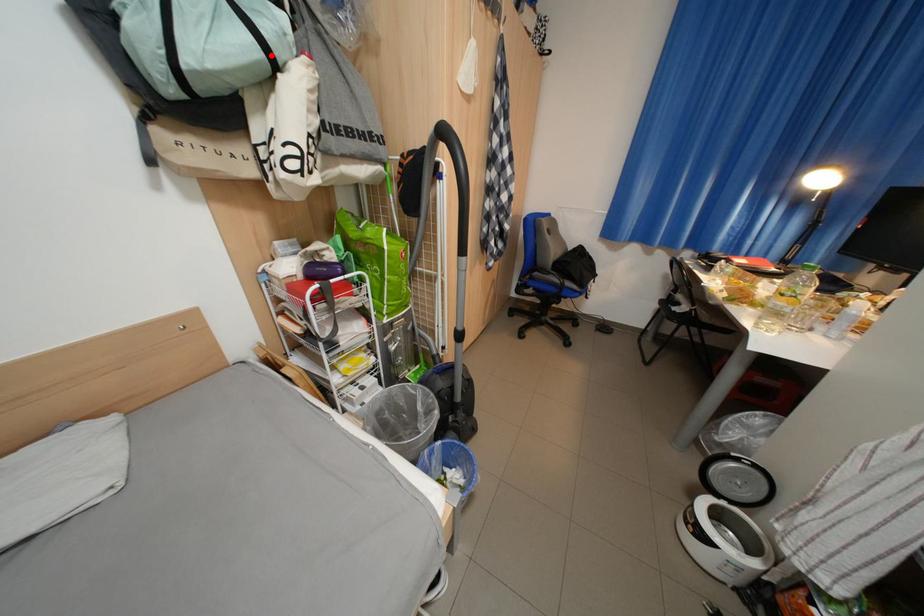
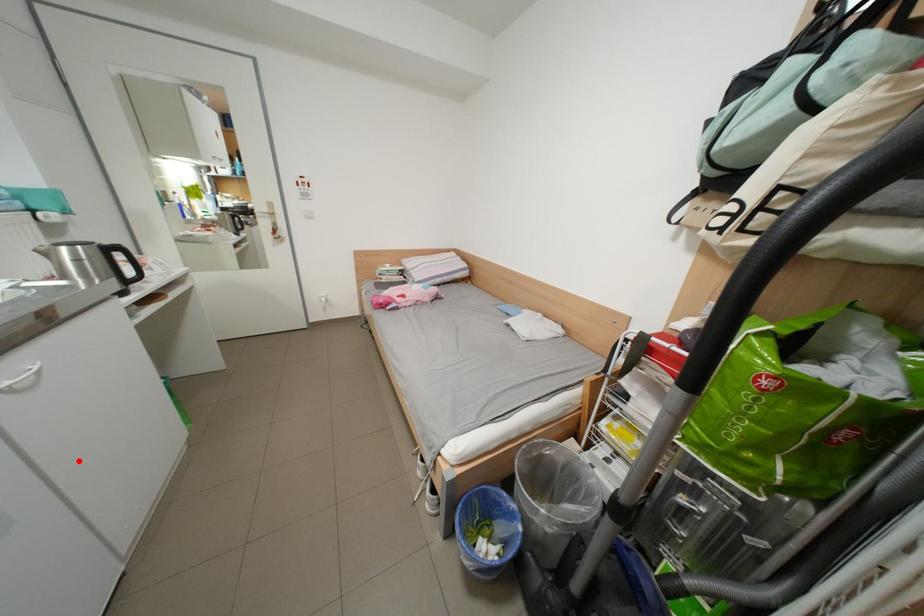
I am providing you with two images of the same scene from different viewpoints. A red point is marked on the first image and another point is marked on the second image. Are the points marked in image1 and image2 representing the same 3D position?

No